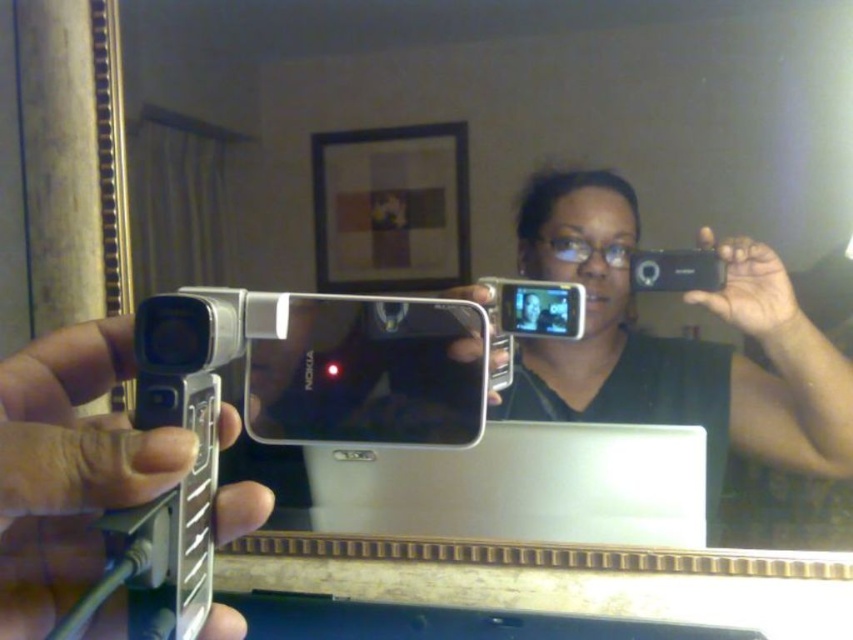
Is point (650, 525) less distant than point (706, 257)?

That is False.

You are a GUI agent. You are given a task and a screenshot of the screen. Output one action in this format:
    pyautogui.click(x=<x>, y=<y>)
    Task: Click on the silver metallic laptop at center
    The width and height of the screenshot is (853, 640).
    Given the screenshot: What is the action you would take?
    pyautogui.click(x=521, y=486)

Who is more forward, (572, 532) or (676, 275)?

Positioned in front is point (676, 275).

This screenshot has width=853, height=640. What are the coordinates of `silver metallic laptop at center` in the screenshot? It's located at (521, 486).

From the picture: Is silver metallic nokia camera at center wider than silver metallic laptop at center?

Incorrect, silver metallic nokia camera at center's width does not surpass silver metallic laptop at center's.

Between silver metallic nokia camera at center and silver metallic laptop at center, which one appears on the left side from the viewer's perspective?

silver metallic nokia camera at center

Locate an element on the screen. silver metallic nokia camera at center is located at coordinates (329, 362).

At what (x,y) coordinates should I click in order to perform the action: click on silver metallic nokia camera at center. Please return your answer as a coordinate pair (x, y). The width and height of the screenshot is (853, 640). Looking at the image, I should click on (329, 362).

Is silver metallic phone at lower left below silver metallic laptop at center?

Incorrect, silver metallic phone at lower left is not positioned below silver metallic laptop at center.

Describe the element at coordinates (68, 468) in the screenshot. I see `silver metallic phone at lower left` at that location.

Where is `silver metallic phone at lower left`? The image size is (853, 640). silver metallic phone at lower left is located at coordinates (68, 468).